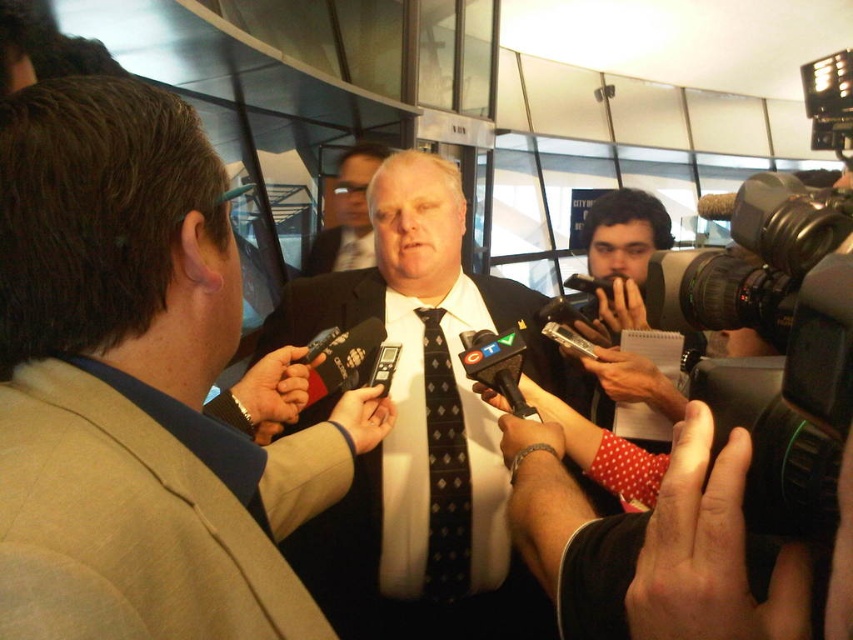
You are a photographer at the event and need to capture a closeup of the light brown suit at center. According to the scene coordinates, where should you aim your camera?

→ The light brown suit at center is located at coordinates point (135, 387), so aim your camera there.